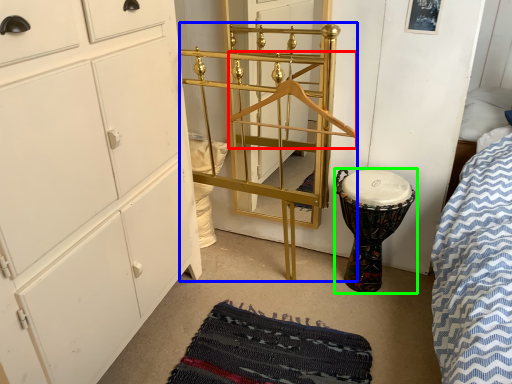
Question: Estimate the real-world distances between objects in this image. Which object is farther from hanger (highlighted by a red box), bunk bed (highlighted by a blue box) or drum (highlighted by a green box)?

Choices:
 (A) bunk bed
 (B) drum

Answer: (B)